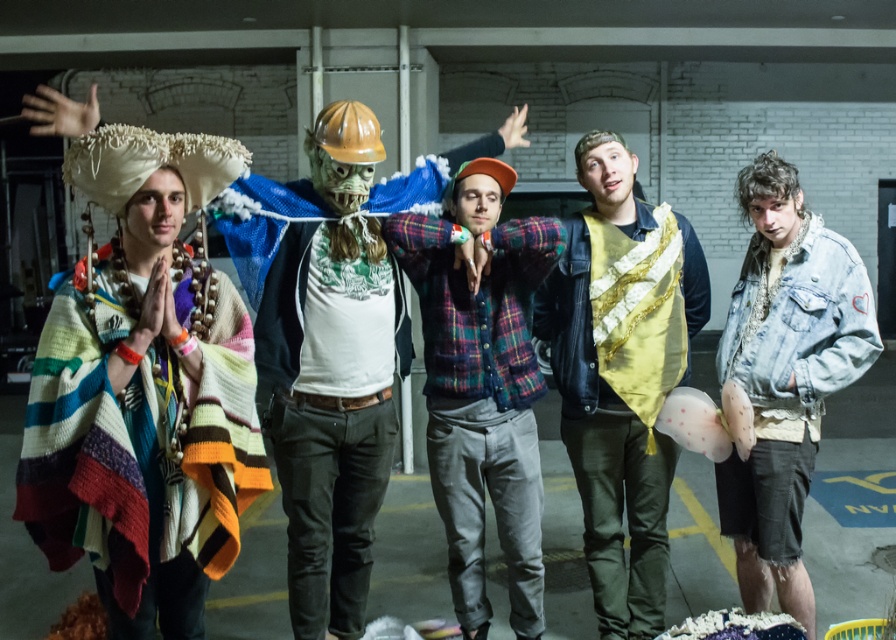
Question: Can you confirm if knitted wool poncho at left is thinner than knitted wool sweater at left?

Choices:
 (A) no
 (B) yes

Answer: (B)

Question: Which point is closer to the camera taking this photo?

Choices:
 (A) (234, 371)
 (B) (444, 488)
 (C) (595, 384)
 (D) (389, 394)

Answer: (A)

Question: Which of these objects is positioned closest to the gold sequined vest at center?

Choices:
 (A) knitted wool sweater at left
 (B) plaid flannel shirt at center
 (C) denim jacket at lower right
 (D) knitted wool poncho at left

Answer: (B)

Question: Is knitted wool poncho at left further to the viewer compared to gold sequined vest at center?

Choices:
 (A) yes
 (B) no

Answer: (B)

Question: Which of the following is the farthest from the observer?

Choices:
 (A) plaid flannel shirt at center
 (B) knitted wool poncho at left
 (C) hard plastic mask at center

Answer: (A)

Question: Is plaid flannel shirt at center thinner than gold sequined vest at center?

Choices:
 (A) yes
 (B) no

Answer: (A)